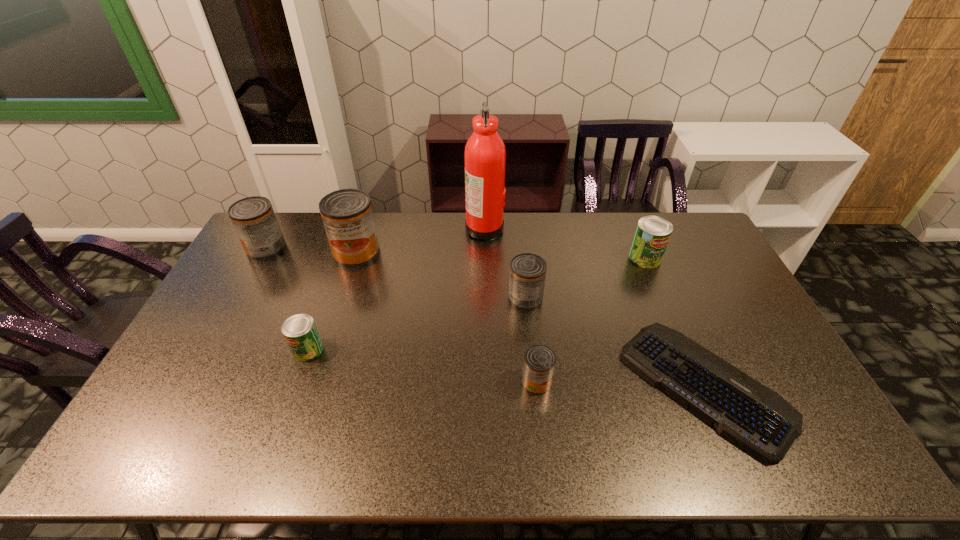
Find the location of `red can that is the third closest to the third nearest can`. red can that is the third closest to the third nearest can is located at coordinates (254, 219).

This screenshot has width=960, height=540. Identify the location of red can that stands as the fourth closest to the computer keyboard. (254, 219).

Where is `free spot that satisfies the following two spatial constraints: 1. on the label side of the farther green can; 2. on the left side of the fire extinguisher`? This screenshot has width=960, height=540. free spot that satisfies the following two spatial constraints: 1. on the label side of the farther green can; 2. on the left side of the fire extinguisher is located at coordinates (485, 258).

You are a GUI agent. You are given a task and a screenshot of the screen. Output one action in this format:
    pyautogui.click(x=<x>, y=<y>)
    Task: Click on the free spot that satisfies the following two spatial constraints: 1. on the label side of the fire extinguisher; 2. on the right side of the third nearest can
    
    Given the screenshot: What is the action you would take?
    point(486,298)

I want to click on free spot that satisfies the following two spatial constraints: 1. on the front side of the computer keyboard; 2. on the right side of the tallest can, so click(x=314, y=386).

Find the location of `free spot that satisfies the following two spatial constraints: 1. on the label side of the tallest object; 2. on the back side of the computer keyboard`. free spot that satisfies the following two spatial constraints: 1. on the label side of the tallest object; 2. on the back side of the computer keyboard is located at coordinates (487, 386).